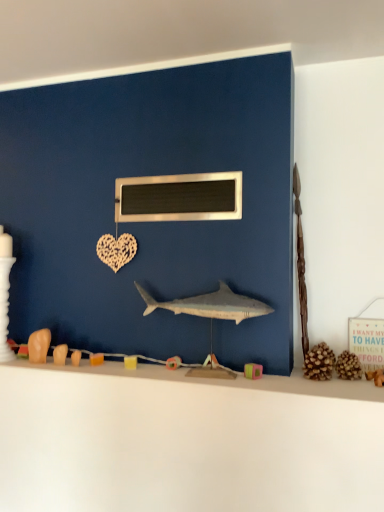
Question: Based on their sizes in the image, would you say white matte counter top at lower center is bigger or smaller than metallic rectangular object at center?

Choices:
 (A) small
 (B) big

Answer: (B)

Question: From their relative heights in the image, would you say white matte counter top at lower center is taller or shorter than metallic rectangular object at center?

Choices:
 (A) tall
 (B) short

Answer: (A)

Question: Which is farther from the white matte counter top at lower center?

Choices:
 (A) smooth gray shark at center
 (B) blue matte wall at center
 (C) metallic rectangular object at center

Answer: (C)

Question: Which is farther from the metallic rectangular object at center?

Choices:
 (A) blue matte wall at center
 (B) white matte counter top at lower center
 (C) smooth gray shark at center

Answer: (B)